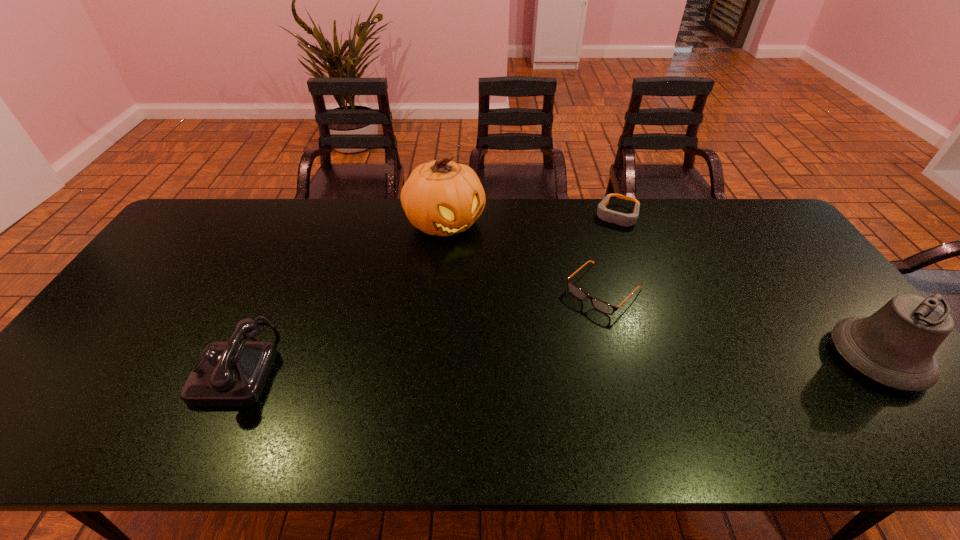
Where is `free space between the leftmost object and the goggles`? free space between the leftmost object and the goggles is located at coordinates (429, 289).

Identify the location of vacant area that lies between the third nearest object and the tallest object. Image resolution: width=960 pixels, height=540 pixels. pos(524,256).

Where is `free spot between the pumpkin and the rightmost object`? free spot between the pumpkin and the rightmost object is located at coordinates (661, 291).

This screenshot has height=540, width=960. What are the coordinates of `object that is the fourth nearest to the leftmost object` in the screenshot? It's located at coord(895,346).

In order to click on object that is the third closest to the tallest object in this screenshot , I will do `click(227, 373)`.

Identify the location of free space that satisfies the following two spatial constraints: 1. on the front side of the third nearest object; 2. on the left side of the pumpkin. (439, 289).

You are a GUI agent. You are given a task and a screenshot of the screen. Output one action in this format:
    pyautogui.click(x=<x>, y=<y>)
    Task: Click on the blank area in the image that satisfies the following two spatial constraints: 1. on the front side of the third farthest object; 2. on the right side of the fourth shortest object
    This screenshot has height=540, width=960.
    Given the screenshot: What is the action you would take?
    622,358

This screenshot has width=960, height=540. In order to click on vacant space that satisfies the following two spatial constraints: 1. on the front side of the third nearest object; 2. on the right side of the bell in this screenshot , I will do `click(622, 358)`.